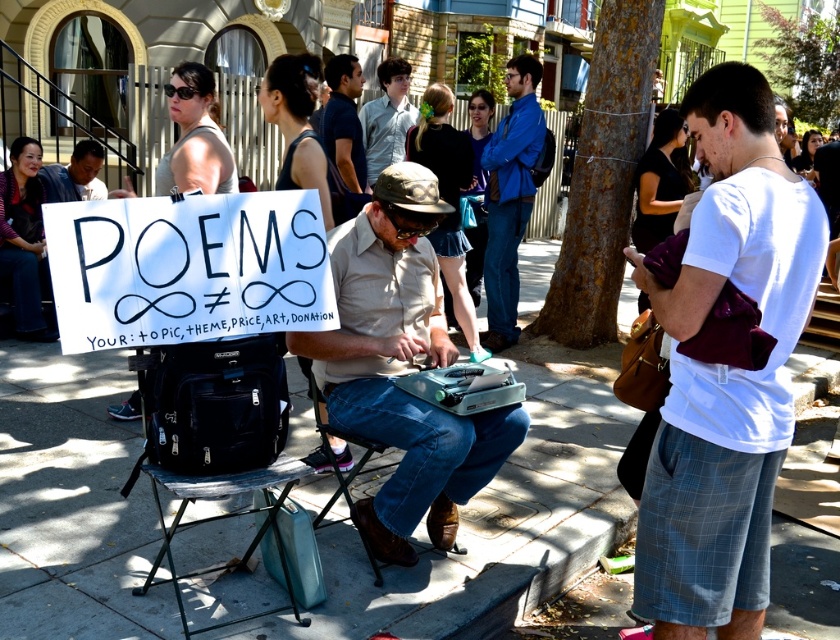
Question: Does white cotton t-shirt at center appear on the right side of black fabric folding chair at lower left?

Choices:
 (A) yes
 (B) no

Answer: (A)

Question: Is black fabric folding chair at lower left behind light blue shirt at center?

Choices:
 (A) yes
 (B) no

Answer: (B)

Question: Which of the following is the farthest from the observer?

Choices:
 (A) white cotton t-shirt at center
 (B) khaki cotton shirt at center
 (C) matte black shirt at left
 (D) metallic folding chair at center

Answer: (C)

Question: Can you confirm if black fabric folding chair at lower left is positioned above light blue shirt at center?

Choices:
 (A) yes
 (B) no

Answer: (B)

Question: Which of these objects is positioned closest to the white cotton t-shirt at center?

Choices:
 (A) metallic folding chair at center
 (B) blue fabric jacket at center
 (C) white paper sign at center

Answer: (C)

Question: Which object is positioned closest to the black fabric folding chair at lower left?

Choices:
 (A) blue fabric jacket at center
 (B) matte black shirt at left

Answer: (A)